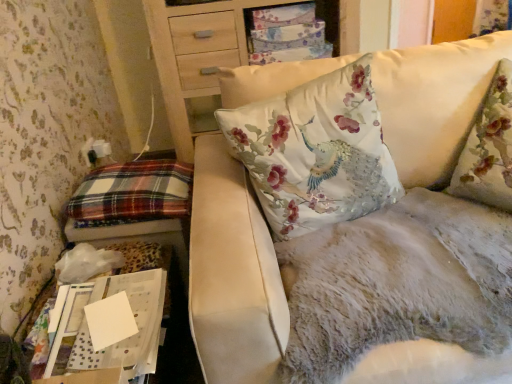
Question: Is floral fabric cushion at upper center aimed at plaid fabric pillow at left?

Choices:
 (A) no
 (B) yes

Answer: (B)

Question: Is the depth of floral fabric cushion at upper center greater than that of plaid fabric pillow at left?

Choices:
 (A) yes
 (B) no

Answer: (A)

Question: Is floral fabric cushion at upper center bigger than plaid fabric pillow at left?

Choices:
 (A) no
 (B) yes

Answer: (B)

Question: From a real-world perspective, is floral fabric cushion at upper center below plaid fabric pillow at left?

Choices:
 (A) yes
 (B) no

Answer: (B)

Question: From a real-world perspective, is floral fabric cushion at upper center on top of plaid fabric pillow at left?

Choices:
 (A) no
 (B) yes

Answer: (B)

Question: Considering the positions of floral fabric cushion at upper center and white paper at lower left in the image, is floral fabric cushion at upper center wider or thinner than white paper at lower left?

Choices:
 (A) thin
 (B) wide

Answer: (B)

Question: From the image's perspective, is floral fabric cushion at upper center above or below white paper at lower left?

Choices:
 (A) below
 (B) above

Answer: (B)

Question: Is point (340, 52) closer or farther from the camera than point (130, 291)?

Choices:
 (A) closer
 (B) farther

Answer: (B)

Question: Looking at the image, does floral fabric cushion at upper center seem bigger or smaller compared to white paper at lower left?

Choices:
 (A) big
 (B) small

Answer: (A)

Question: Is plaid fabric pillow at left in front of or behind fluffy white couch at upper right in the image?

Choices:
 (A) behind
 (B) front

Answer: (A)

Question: From a real-world perspective, is plaid fabric pillow at left physically located above or below fluffy white couch at upper right?

Choices:
 (A) above
 (B) below

Answer: (B)

Question: Looking at their shapes, would you say plaid fabric pillow at left is wider or thinner than fluffy white couch at upper right?

Choices:
 (A) wide
 (B) thin

Answer: (B)

Question: Looking at the image, does plaid fabric pillow at left seem bigger or smaller compared to fluffy white couch at upper right?

Choices:
 (A) big
 (B) small

Answer: (B)

Question: Considering the positions of point (163, 82) and point (140, 205), is point (163, 82) closer or farther from the camera than point (140, 205)?

Choices:
 (A) closer
 (B) farther

Answer: (B)

Question: Considering the positions of floral fabric cushion at upper center and plaid fabric pillow at left in the image, is floral fabric cushion at upper center bigger or smaller than plaid fabric pillow at left?

Choices:
 (A) small
 (B) big

Answer: (B)